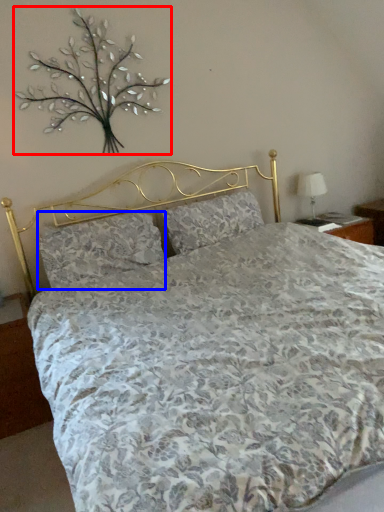
Question: Which point is closer to the camera, floral arrangement (highlighted by a red box) or pillow (highlighted by a blue box)?

Choices:
 (A) floral arrangement
 (B) pillow

Answer: (A)